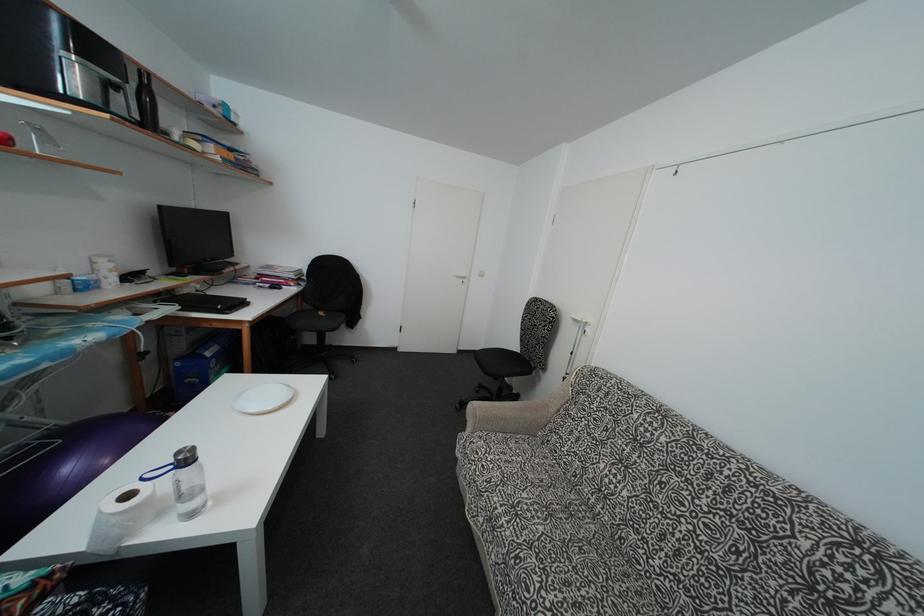
The image size is (924, 616). What do you see at coordinates (541, 537) in the screenshot? I see `the sofa sitting surface` at bounding box center [541, 537].